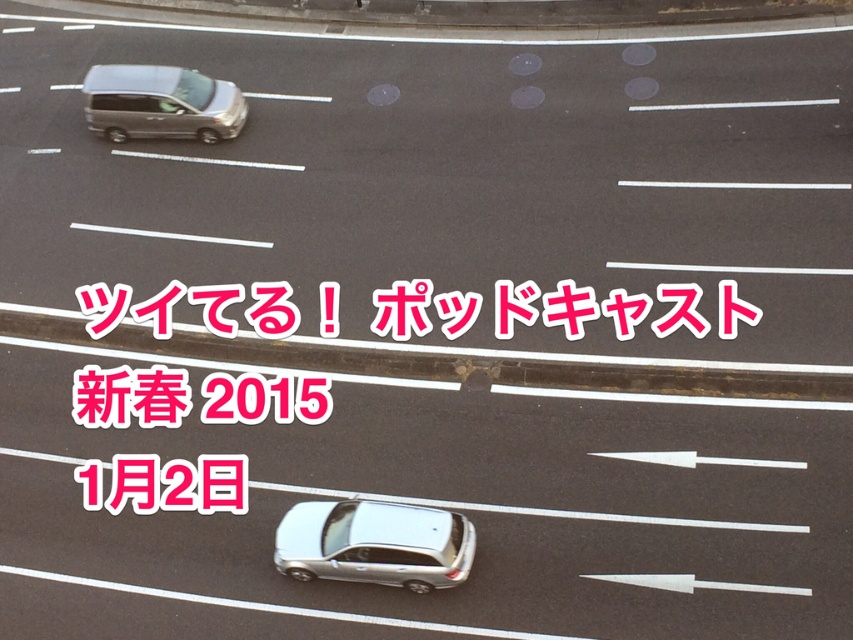
At what (x,y) coordinates should I click in order to perform the action: click on pink glossy text at upper center. Please return your answer as a coordinate pair (x, y). Looking at the image, I should click on (566, 308).

Is pink glossy text at upper center shorter than satin silver sedan at lower center?

Yes.

This screenshot has height=640, width=853. What do you see at coordinates (566, 308) in the screenshot? I see `pink glossy text at upper center` at bounding box center [566, 308].

The width and height of the screenshot is (853, 640). I want to click on pink glossy text at upper center, so click(566, 308).

Describe the element at coordinates (566, 308) in the screenshot. I see `pink glossy text at upper center` at that location.

This screenshot has width=853, height=640. In order to click on pink glossy text at upper center in this screenshot , I will do `click(566, 308)`.

Locate an element on the screen. pink glossy text at upper center is located at coordinates (566, 308).

Is point (90, 424) positioned before point (593, 300)?

Yes, point (90, 424) is in front of point (593, 300).

Is pink paper text at center to the right of pink glossy text at upper center from the viewer's perspective?

Yes, pink paper text at center is to the right of pink glossy text at upper center.

Find the location of a particular element. The width and height of the screenshot is (853, 640). pink paper text at center is located at coordinates (131, 396).